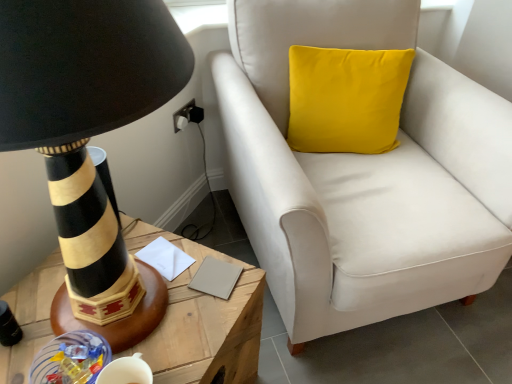
Question: Considering the positions of white paper at center, the first notepad viewed from the left, and wooden table at left in the image, is white paper at center, the first notepad viewed from the left, taller or shorter than wooden table at left?

Choices:
 (A) short
 (B) tall

Answer: (A)

Question: Considering the relative positions of white paper at center, the first notepad viewed from the left, and wooden table at left in the image provided, is white paper at center, the first notepad viewed from the left, to the left or to the right of wooden table at left?

Choices:
 (A) right
 (B) left

Answer: (A)

Question: Which of these objects is positioned closest to the wooden table at left?

Choices:
 (A) beige matte notepad at center, which is the 2th notepad in left-to-right order
 (B) velvet white armchair at upper right
 (C) white paper at center, the first notepad viewed from the left
 (D) black striped lamp at left

Answer: (A)

Question: Which object is the farthest from the black striped lamp at left?

Choices:
 (A) wooden table at left
 (B) beige matte notepad at center, which is the 2th notepad in left-to-right order
 (C) velvet white armchair at upper right
 (D) white paper at center, the first notepad viewed from the left

Answer: (C)